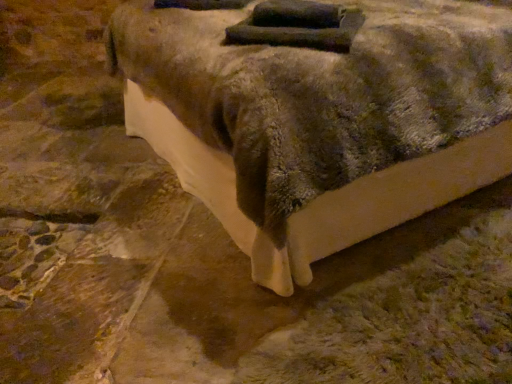
Measure the distance between point (x=450, y=114) and camera.

They are 1.25 meters apart.

Describe the element at coordinates (319, 119) in the screenshot. The height and width of the screenshot is (384, 512). I see `velvet-like brown bed at center` at that location.

The width and height of the screenshot is (512, 384). I want to click on velvet-like brown bed at center, so click(x=319, y=119).

You are a GUI agent. You are given a task and a screenshot of the screen. Output one action in this format:
    pyautogui.click(x=<x>, y=<y>)
    Task: Click on the velvet-like brown bed at center
    
    Given the screenshot: What is the action you would take?
    click(x=319, y=119)